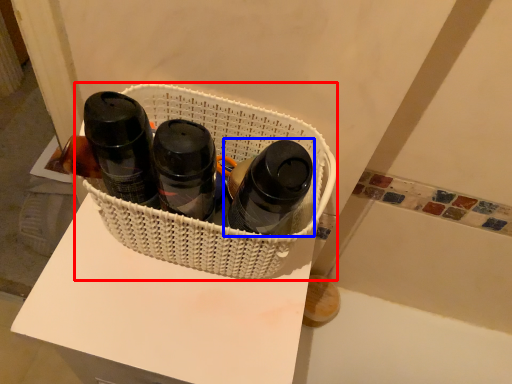
Question: Which object appears farthest to the camera in this image, basket (highlighted by a red box) or bottle (highlighted by a blue box)?

Choices:
 (A) basket
 (B) bottle

Answer: (A)